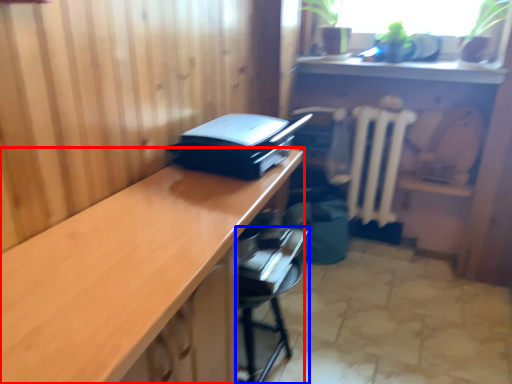
Question: Which object appears closest to the camera in this image, desk (highlighted by a red box) or furniture (highlighted by a blue box)?

Choices:
 (A) desk
 (B) furniture

Answer: (A)